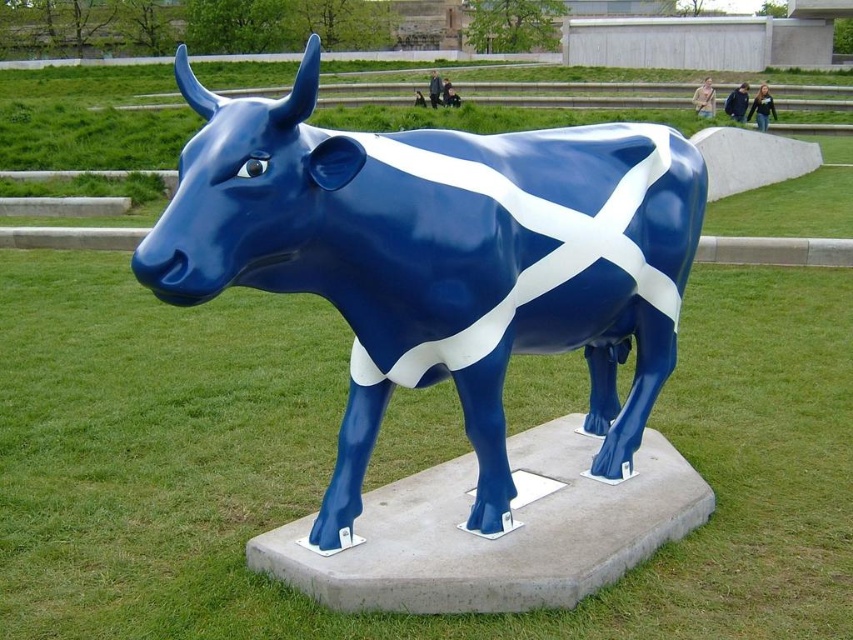
Question: Is green grass at center positioned in front of glossy blue bull at center?

Choices:
 (A) yes
 (B) no

Answer: (B)

Question: Is green grass at center positioned before glossy blue bull at center?

Choices:
 (A) yes
 (B) no

Answer: (B)

Question: Can you confirm if green grass at center is wider than glossy blue bull at center?

Choices:
 (A) yes
 (B) no

Answer: (B)

Question: Which point is farther to the camera?

Choices:
 (A) green grass at center
 (B) glossy blue bull at center

Answer: (A)

Question: Among these objects, which one is nearest to the camera?

Choices:
 (A) glossy blue bull at center
 (B) green grass at center

Answer: (A)